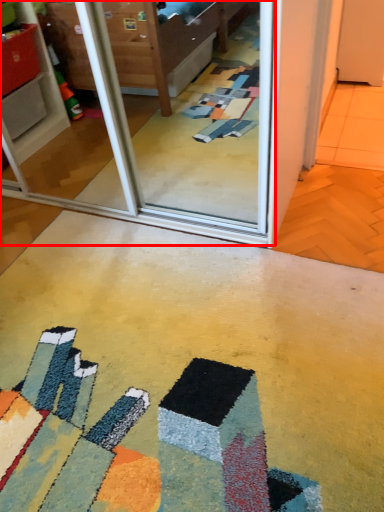
Question: In this image, where is screen door (annotated by the red box) located relative to concrete?

Choices:
 (A) left
 (B) right

Answer: (A)